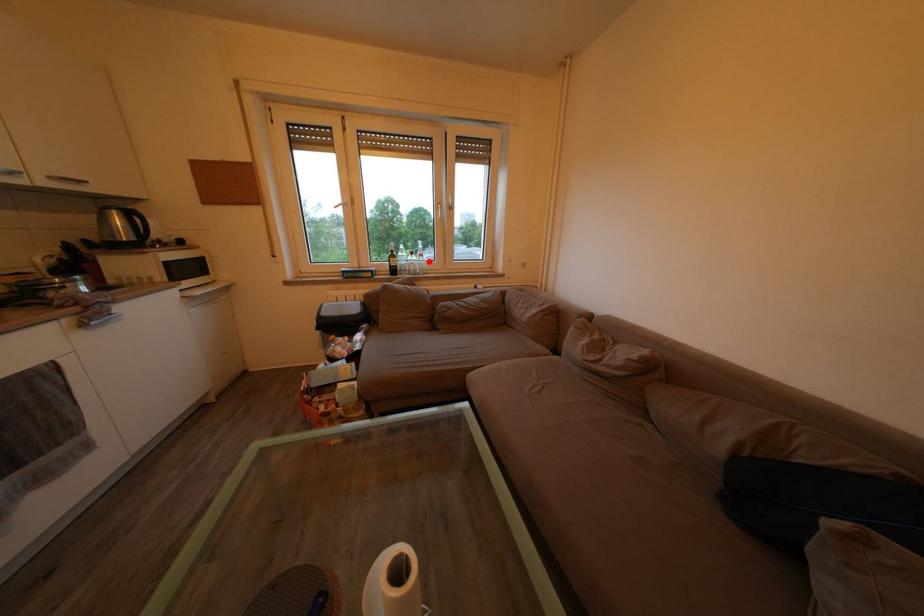
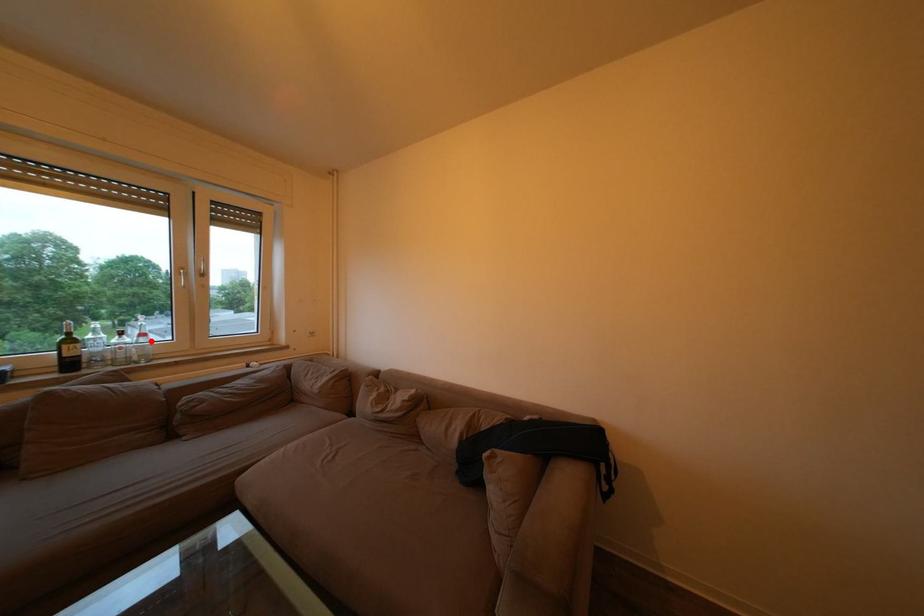
I am providing you with two images of the same scene from different viewpoints. A red point is marked on the first image and another point is marked on the second image. Is the marked point in image1 the same physical position as the marked point in image2?

Yes